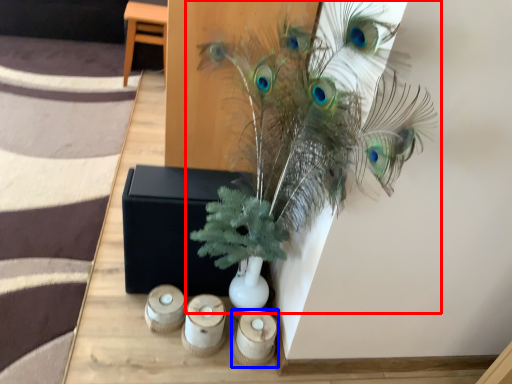
Question: Among these objects, which one is farthest to the camera, houseplant (highlighted by a red box) or candle holder (highlighted by a blue box)?

Choices:
 (A) houseplant
 (B) candle holder

Answer: (B)